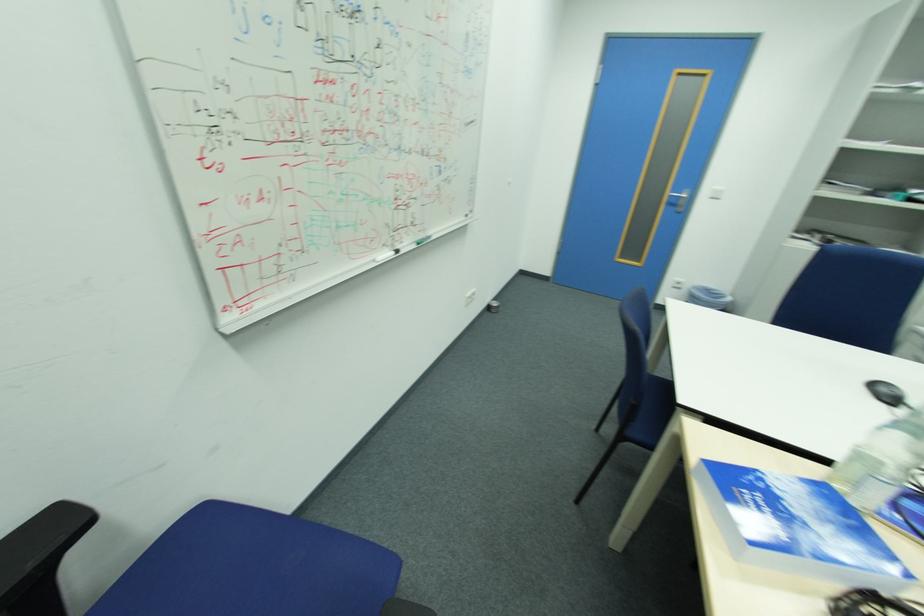
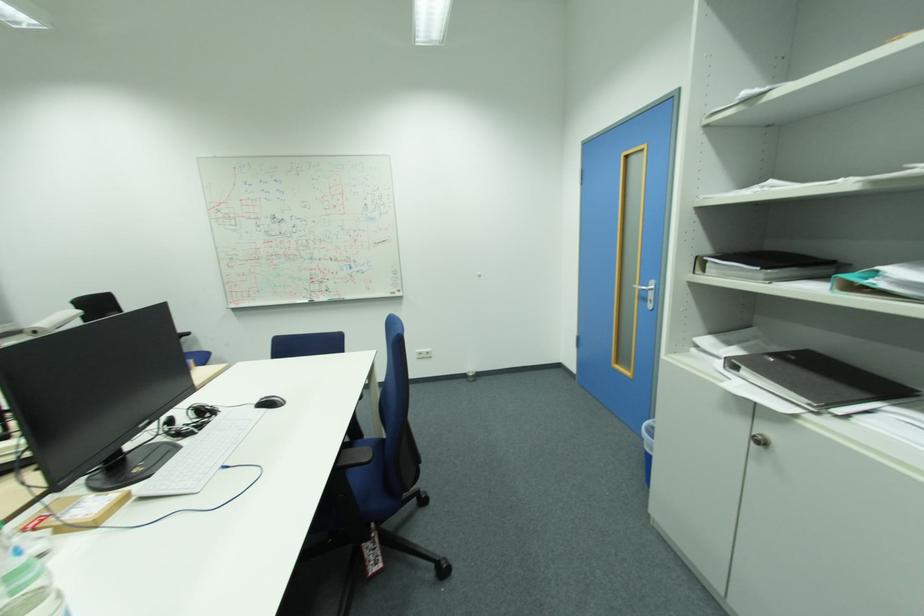
Question: I am providing you with two images of the same scene from different viewpoints. Which of the following objects are not visible in image2?

Choices:
 (A) silver cabinet lock
 (B) blue chair sitting surface
 (C) black notebook
 (D) ceiling vent cover

Answer: (B)